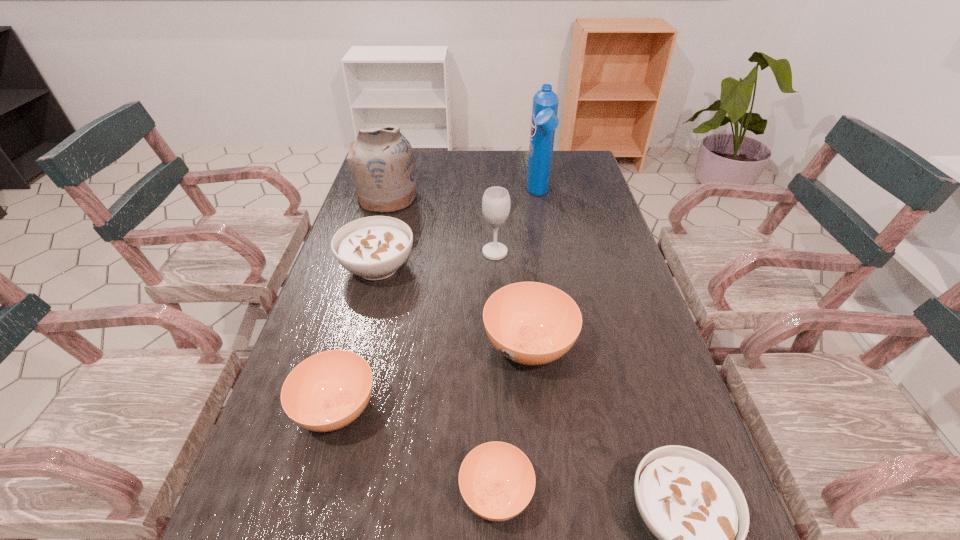
Identify the location of the second closest peach soup bowl to the tallest object. The width and height of the screenshot is (960, 540). (327, 391).

Identify which peach soup bowl is the third nearest to the rightmost object. Please provide its 2D coordinates. Your answer should be formatted as a tuple, i.e. [(x, y)], where the tuple contains the x and y coordinates of a point satisfying the conditions above.

[(327, 391)]

Where is `white soup bowl object that ranks as the closest to the shampoo`? The width and height of the screenshot is (960, 540). white soup bowl object that ranks as the closest to the shampoo is located at coordinates (374, 247).

Locate an element on the screen. This screenshot has height=540, width=960. free space that satisfies the following two spatial constraints: 1. on the front side of the smallest peach soup bowl; 2. on the right side of the seventh shortest object is located at coordinates (302, 494).